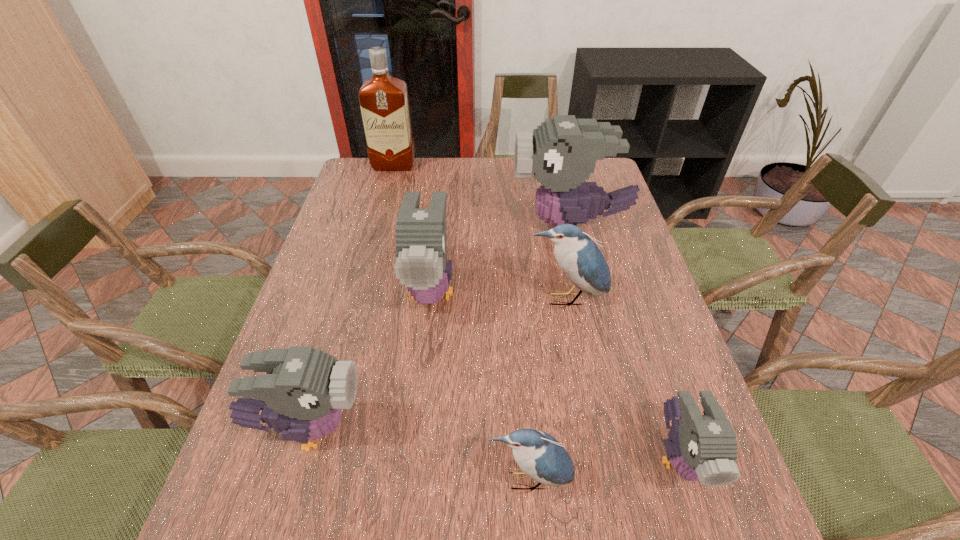
Identify which gray bird is the second nearest to the farthest object. Please provide its 2D coordinates. Your answer should be formatted as a tuple, i.e. [(x, y)], where the tuple contains the x and y coordinates of a point satisfying the conditions above.

[(421, 240)]

The height and width of the screenshot is (540, 960). Identify the location of free space that satisfies the following two spatial constraints: 1. at the beak of the biggest gray bird; 2. at the tip of the bigger blue bird's beak. (588, 299).